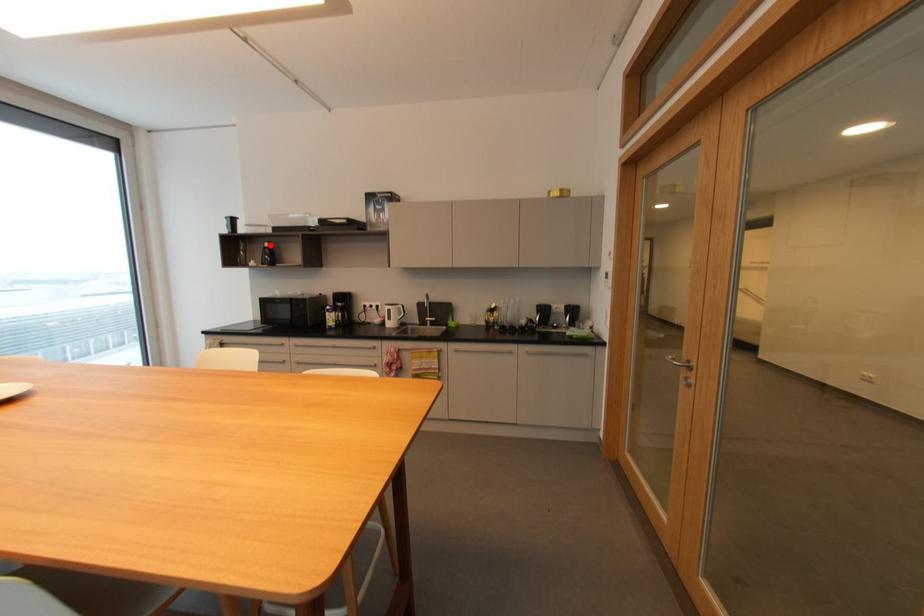
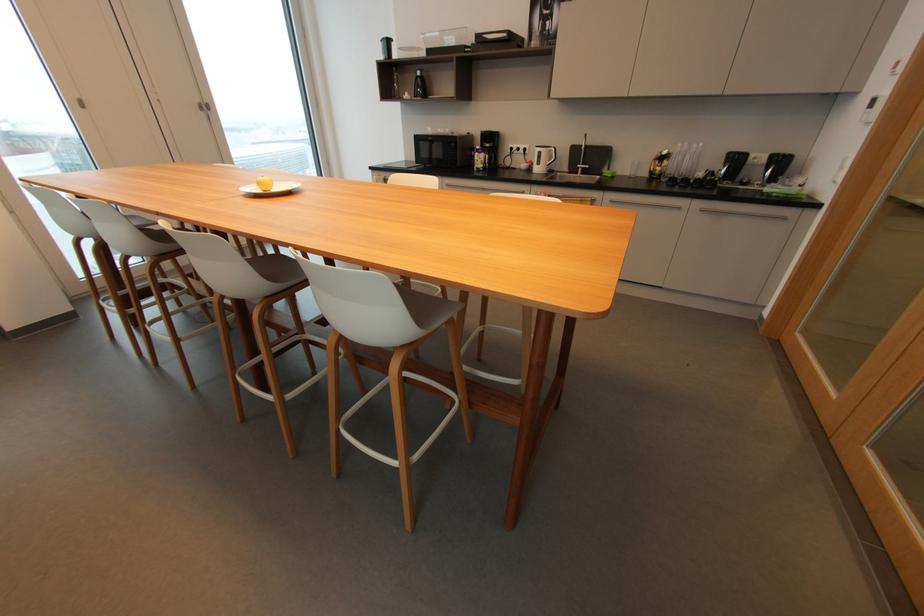
Where in the second image is the point corresponding to the highlighted location from the first image?

(421, 74)